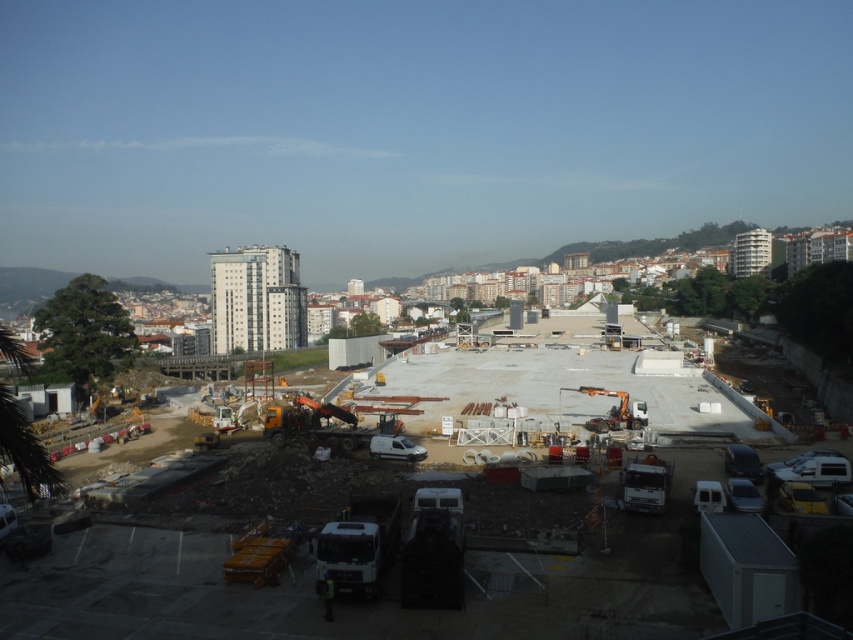
You are a construction worker standing at the entrance of the construction site. You need to locate the white concrete construction site at center. According to the coordinates provided, where should you look?

You should look at point (386, 580) to find the white concrete construction site at center.

You are a delivery truck driver who needs to deliver materials to the construction site. Your truck is 12 meters long. You see the white concrete construction site at center and the white metallic crane at center. Can you safely maneuver your truck between them without hitting either?

The distance between the white concrete construction site at center and the white metallic crane at center is 29.42 meters. Since your truck is 12 meters long, there is enough space to maneuver safely between them.